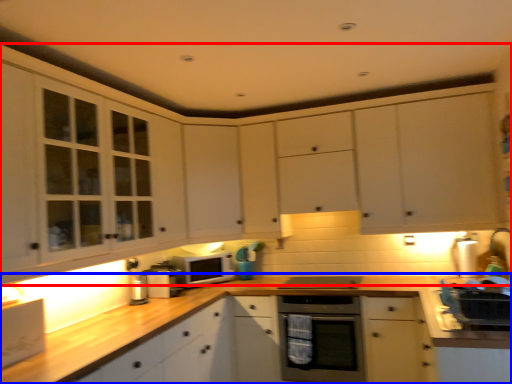
Question: Which object is further to the camera taking this photo, cabinetry (highlighted by a red box) or countertop (highlighted by a blue box)?

Choices:
 (A) cabinetry
 (B) countertop

Answer: (B)